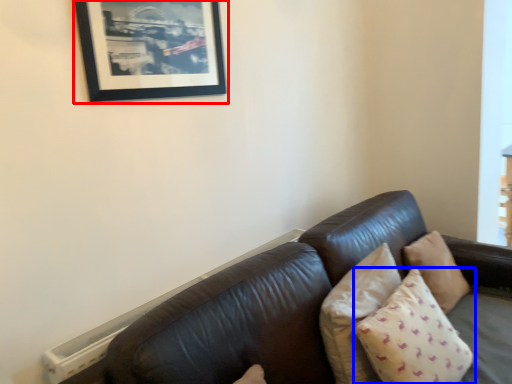
Question: Among these objects, which one is nearest to the camera, picture frame (highlighted by a red box) or pillow (highlighted by a blue box)?

Choices:
 (A) picture frame
 (B) pillow

Answer: (B)